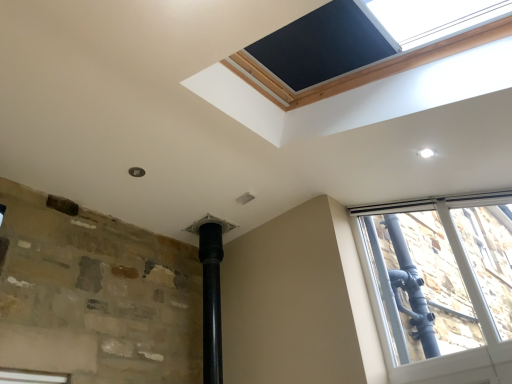
Question: From the image's perspective, relative to clear glass window at upper right, is black matte window screen at upper center above or below?

Choices:
 (A) below
 (B) above

Answer: (B)

Question: Relative to clear glass window at upper right, is black matte window screen at upper center in front or behind?

Choices:
 (A) front
 (B) behind

Answer: (A)

Question: Is point coord(298,46) positioned closer to the camera than point coord(369,274)?

Choices:
 (A) farther
 (B) closer

Answer: (B)

Question: Looking at their shapes, would you say clear glass window at upper right is wider or thinner than black matte window screen at upper center?

Choices:
 (A) thin
 (B) wide

Answer: (A)

Question: Considering their positions, is clear glass window at upper right located in front of or behind black matte window screen at upper center?

Choices:
 (A) front
 (B) behind

Answer: (B)

Question: From a real-world perspective, is clear glass window at upper right positioned above or below black matte window screen at upper center?

Choices:
 (A) above
 (B) below

Answer: (B)

Question: Is point (395, 344) positioned closer to the camera than point (324, 41)?

Choices:
 (A) farther
 (B) closer

Answer: (A)